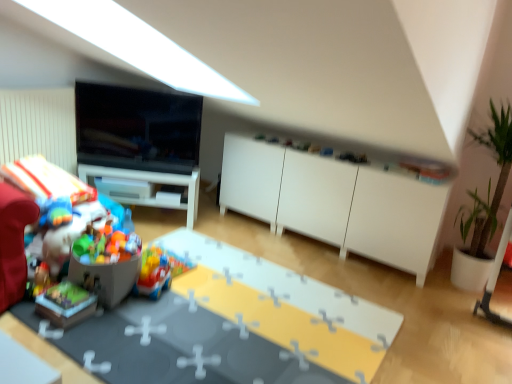
Question: Does matte plastic table at lower left have a larger size compared to green leafy plant in pot at right?

Choices:
 (A) yes
 (B) no

Answer: (B)

Question: Does matte plastic table at lower left lie behind green leafy plant in pot at right?

Choices:
 (A) no
 (B) yes

Answer: (A)

Question: Does matte plastic table at lower left appear on the right side of green leafy plant in pot at right?

Choices:
 (A) yes
 (B) no

Answer: (B)

Question: Does matte plastic table at lower left have a lesser width compared to green leafy plant in pot at right?

Choices:
 (A) yes
 (B) no

Answer: (B)

Question: Is matte plastic table at lower left oriented away from green leafy plant in pot at right?

Choices:
 (A) no
 (B) yes

Answer: (A)

Question: Is matte black tv at upper left situated inside multicolored plastic toys at left, which is the 4th toy from right to left, or outside?

Choices:
 (A) inside
 (B) outside

Answer: (B)

Question: Would you say matte black tv at upper left is to the left or to the right of multicolored plastic toys at left, which is the 4th toy from right to left, in the picture?

Choices:
 (A) left
 (B) right

Answer: (B)

Question: From a real-world perspective, is matte black tv at upper left positioned above or below multicolored plastic toys at left, which is the 4th toy from right to left?

Choices:
 (A) above
 (B) below

Answer: (A)

Question: In terms of height, does matte black tv at upper left look taller or shorter compared to multicolored plastic toys at left, which is the 4th toy from right to left?

Choices:
 (A) short
 (B) tall

Answer: (B)

Question: Relative to wooden block at lower left, the 3th toy positioned from the right, is white glossy desk at center in front or behind?

Choices:
 (A) behind
 (B) front

Answer: (A)

Question: In terms of height, does white glossy desk at center look taller or shorter compared to wooden block at lower left, arranged as the 2th toy when viewed from the left?

Choices:
 (A) tall
 (B) short

Answer: (A)

Question: Is white glossy desk at center bigger or smaller than wooden block at lower left, arranged as the 2th toy when viewed from the left?

Choices:
 (A) big
 (B) small

Answer: (A)

Question: Would you say white glossy desk at center is to the left or to the right of wooden block at lower left, arranged as the 2th toy when viewed from the left, in the picture?

Choices:
 (A) left
 (B) right

Answer: (B)

Question: In the image, is wooden block at lower left, the 3th toy positioned from the right, positioned in front of or behind matte plastic table at lower left?

Choices:
 (A) behind
 (B) front

Answer: (A)

Question: Considering the positions of point (61, 301) and point (291, 302), is point (61, 301) closer or farther from the camera than point (291, 302)?

Choices:
 (A) closer
 (B) farther

Answer: (A)